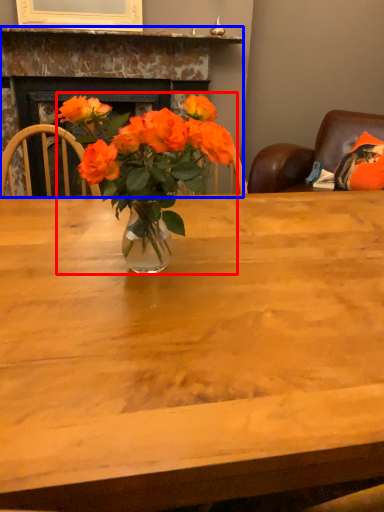
Question: Which object appears closest to the camera in this image, houseplant (highlighted by a red box) or fireplace (highlighted by a blue box)?

Choices:
 (A) houseplant
 (B) fireplace

Answer: (A)